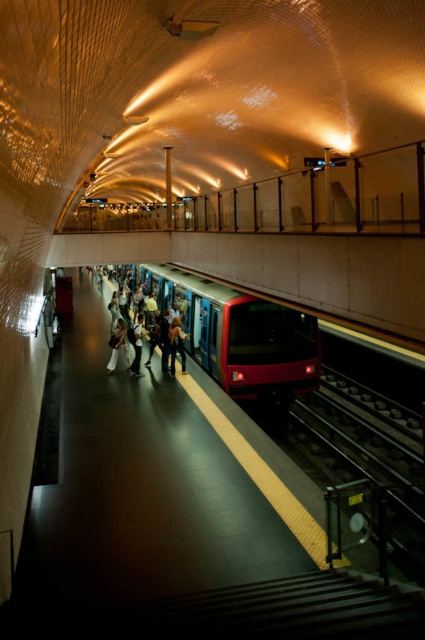
How distant is metallic red train at center from light beige fabric bag at center?

1.52 meters

Can you confirm if metallic red train at center is shorter than light beige fabric bag at center?

Incorrect, metallic red train at center's height does not fall short of light beige fabric bag at center's.

This screenshot has width=425, height=640. Find the location of `metallic red train at center`. metallic red train at center is located at coordinates (241, 336).

Is light beige fabric bag at center taller than light beige fabric jacket at center?

Correct, light beige fabric bag at center is much taller as light beige fabric jacket at center.

Is point (181, 371) closer to camera compared to point (141, 339)?

That is True.

The height and width of the screenshot is (640, 425). Identify the location of light beige fabric bag at center. (150, 332).

In the scene shown: Is light beige fabric dress at center smaller than light beige fabric jacket at center?

Actually, light beige fabric dress at center might be larger than light beige fabric jacket at center.

Who is more distant from viewer, (119, 349) or (138, 342)?

The point (119, 349) is behind.

Image resolution: width=425 pixels, height=640 pixels. Find the location of `light beige fabric dress at center`. light beige fabric dress at center is located at coordinates (118, 346).